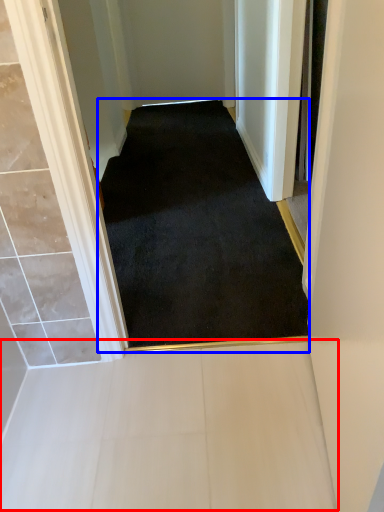
Question: Which object is further to the camera taking this photo, path (highlighted by a red box) or doormat (highlighted by a blue box)?

Choices:
 (A) path
 (B) doormat

Answer: (B)